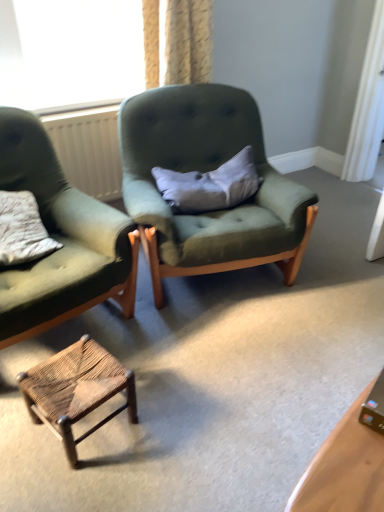
Describe the element at coordinates (76, 390) in the screenshot. Image resolution: width=384 pixels, height=512 pixels. I see `rustic woven stool at lower center` at that location.

What do you see at coordinates (188, 41) in the screenshot?
I see `textured beige curtain at upper center` at bounding box center [188, 41].

Locate an element on the screen. This screenshot has width=384, height=512. white plastic radiator at left is located at coordinates (88, 149).

You are a GUI agent. You are given a task and a screenshot of the screen. Output one action in this format:
    pyautogui.click(x=<x>, y=<y>)
    Task: Click on the rustic woven stool at lower center
    
    Given the screenshot: What is the action you would take?
    pyautogui.click(x=76, y=390)

Does white plastic radiator at left have a greater width compared to rustic woven stool at lower center?

Incorrect, the width of white plastic radiator at left does not surpass that of rustic woven stool at lower center.

From a real-world perspective, which is physically above, white plastic radiator at left or rustic woven stool at lower center?

From a 3D spatial view, white plastic radiator at left is above.

Does point (42, 121) appear closer or farther from the camera than point (33, 375)?

Point (42, 121) appears to be farther away from the viewer than point (33, 375).

Based on their sizes in the image, would you say white plastic radiator at left is bigger or smaller than rustic woven stool at lower center?

Considering their sizes, white plastic radiator at left takes up less space than rustic woven stool at lower center.

Is textured beige curtain at upper center not within white plastic radiator at left?

Yes, textured beige curtain at upper center is located beyond the bounds of white plastic radiator at left.

From the image's perspective, would you say textured beige curtain at upper center is positioned over white plastic radiator at left?

Yes, from the image's perspective, textured beige curtain at upper center is over white plastic radiator at left.

Between textured beige curtain at upper center and white plastic radiator at left, which one has larger size?

Bigger between the two is textured beige curtain at upper center.

Is gray fabric pillow at center at the back of matte green fabric chair at left, acting as the 2th chair starting from the right?

No, gray fabric pillow at center is not at the back of matte green fabric chair at left, acting as the 2th chair starting from the right.

Which is behind, matte green fabric chair at left, acting as the 2th chair starting from the right, or gray fabric pillow at center?

gray fabric pillow at center is behind.

Based on their sizes in the image, would you say matte green fabric chair at left, acting as the 2th chair starting from the right, is bigger or smaller than gray fabric pillow at center?

matte green fabric chair at left, acting as the 2th chair starting from the right, is bigger than gray fabric pillow at center.

Which is correct: matte green fabric chair at left, the 1th chair when ordered from left to right, is inside gray fabric pillow at center, or outside of it?

matte green fabric chair at left, the 1th chair when ordered from left to right, is located beyond the bounds of gray fabric pillow at center.

Who is more distant, rustic woven stool at lower center or textured beige curtain at upper center?

Positioned behind is textured beige curtain at upper center.

From the image's perspective, is rustic woven stool at lower center located above or below textured beige curtain at upper center?

Clearly, from the image's perspective, rustic woven stool at lower center is below textured beige curtain at upper center.

Considering the sizes of objects rustic woven stool at lower center and textured beige curtain at upper center in the image provided, who is taller, rustic woven stool at lower center or textured beige curtain at upper center?

textured beige curtain at upper center is taller.

How different are the orientations of white plastic radiator at left and velvet green armchair at center, acting as the 2th chair starting from the left, in degrees?

The angular difference between white plastic radiator at left and velvet green armchair at center, acting as the 2th chair starting from the left, is 16.9 degrees.

Is velvet green armchair at center, acting as the 2th chair starting from the left, completely or partially inside white plastic radiator at left?

Definitely not — velvet green armchair at center, acting as the 2th chair starting from the left, is not inside white plastic radiator at left.

Identify the location of radiator behind the velvet green armchair at center, acting as the 2th chair starting from the left. This screenshot has width=384, height=512. (88, 149).

Is the position of velvet green armchair at center, acting as the first chair starting from the right, more distant than that of textured beige curtain at upper center?

No, it is not.

Is velvet green armchair at center, acting as the first chair starting from the right, oriented towards textured beige curtain at upper center?

No, velvet green armchair at center, acting as the first chair starting from the right, is not oriented towards textured beige curtain at upper center.

From the image's perspective, is velvet green armchair at center, acting as the 2th chair starting from the left, on top of textured beige curtain at upper center?

No, from the image's perspective, velvet green armchair at center, acting as the 2th chair starting from the left, is not over textured beige curtain at upper center.

From the picture: Between velvet green armchair at center, acting as the 2th chair starting from the left, and textured beige curtain at upper center, which one appears on the left side from the viewer's perspective?

Positioned to the left is textured beige curtain at upper center.

Considering the positions of point (35, 185) and point (112, 374), is point (35, 185) closer or farther from the camera than point (112, 374)?

Point (35, 185) is positioned farther from the camera compared to point (112, 374).

Is matte green fabric chair at left, the 1th chair when ordered from left to right, taller than rustic woven stool at lower center?

Yes.

From the image's perspective, is matte green fabric chair at left, the 1th chair when ordered from left to right, under rustic woven stool at lower center?

No, from the image's perspective, matte green fabric chair at left, the 1th chair when ordered from left to right, is not below rustic woven stool at lower center.

The image size is (384, 512). In the image, there is a matte green fabric chair at left, the 1th chair when ordered from left to right. Identify the location of stool below it (from a real-world perspective). (76, 390).

I want to click on stool located below the white plastic radiator at left (from the image's perspective), so coord(76,390).

This screenshot has width=384, height=512. Identify the location of radiator behind the textured beige curtain at upper center. (88, 149).

When comparing their distances from white plastic radiator at left, does textured beige curtain at upper center or gray fabric pillow at center seem closer?

Based on the image, textured beige curtain at upper center appears to be nearer to white plastic radiator at left.

Looking at the image, which one is located closer to gray fabric pillow at center, textured beige curtain at upper center or white plastic radiator at left?

white plastic radiator at left.

Consider the image. When comparing their distances from textured beige curtain at upper center, does rustic woven stool at lower center or white plastic radiator at left seem further?

rustic woven stool at lower center lies further to textured beige curtain at upper center than the other object.

Considering their positions, is matte green fabric chair at left, the 1th chair when ordered from left to right, positioned further to textured beige curtain at upper center than velvet green armchair at center, acting as the first chair starting from the right?

matte green fabric chair at left, the 1th chair when ordered from left to right.

From the image, which object appears to be farther from textured beige curtain at upper center, white plastic radiator at left or matte green fabric chair at left, the 1th chair when ordered from left to right?

matte green fabric chair at left, the 1th chair when ordered from left to right.

From the image, which object appears to be nearer to rustic woven stool at lower center, velvet green armchair at center, acting as the first chair starting from the right, or white plastic radiator at left?

velvet green armchair at center, acting as the first chair starting from the right.

Estimate the real-world distances between objects in this image. Which object is closer to matte green fabric chair at left, the 1th chair when ordered from left to right, velvet green armchair at center, acting as the 2th chair starting from the left, or gray fabric pillow at center?

Among the two, velvet green armchair at center, acting as the 2th chair starting from the left, is located nearer to matte green fabric chair at left, the 1th chair when ordered from left to right.

From the picture: Considering their positions, is white plastic radiator at left positioned further to rustic woven stool at lower center than velvet green armchair at center, acting as the first chair starting from the right?

white plastic radiator at left lies further to rustic woven stool at lower center than the other object.

The width and height of the screenshot is (384, 512). In order to click on pillow between textured beige curtain at upper center and velvet green armchair at center, acting as the 2th chair starting from the left, from top to bottom in this screenshot , I will do `click(210, 185)`.

You are a GUI agent. You are given a task and a screenshot of the screen. Output one action in this format:
    pyautogui.click(x=<x>, y=<y>)
    Task: Click on the chair between matte green fabric chair at left, acting as the 2th chair starting from the right, and white plastic radiator at left, along the z-axis
    
    Given the screenshot: What is the action you would take?
    pyautogui.click(x=206, y=170)

Identify the location of chair between white plastic radiator at left and gray fabric pillow at center in the horizontal direction. (206, 170).

The image size is (384, 512). I want to click on radiator that lies between textured beige curtain at upper center and gray fabric pillow at center from top to bottom, so click(88, 149).